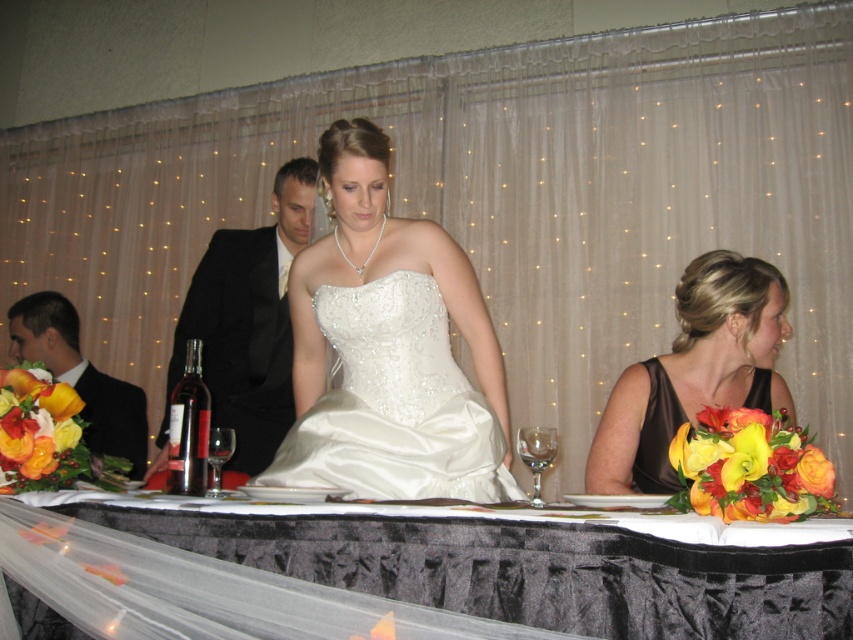
You are a photographer at the wedding reception. You need to capture a shot of the satin black dress at lower right and the clear glass wine glass at center. Which object is positioned higher in the image?

The satin black dress at lower right is located above the clear glass wine glass at center, so it is positioned higher in the image.

You are a server at the wedding reception. You need to place a 16.07 inch long decorative ribbon between the black satin tablecloth at center and the transparent glass wine glass at center. Is there enough space to place the ribbon without overlapping either object?

The black satin tablecloth at center is 16.07 inches from the transparent glass wine glass at center, so the 16.07 inch long decorative ribbon can be placed between them without overlapping either object.

You are a server at the wedding reception. You need to pour wine into both the transparent glass wine glass at center and the clear glass wine glass at center. Which glass should you pour into first if you want to serve the same amount of wine but use less liquid?

You should pour into the transparent glass wine glass at center first because it might be wider than the clear glass wine glass at center, allowing the same volume of wine to occupy less height in the wider glass, thus using less liquid to reach the desired level.